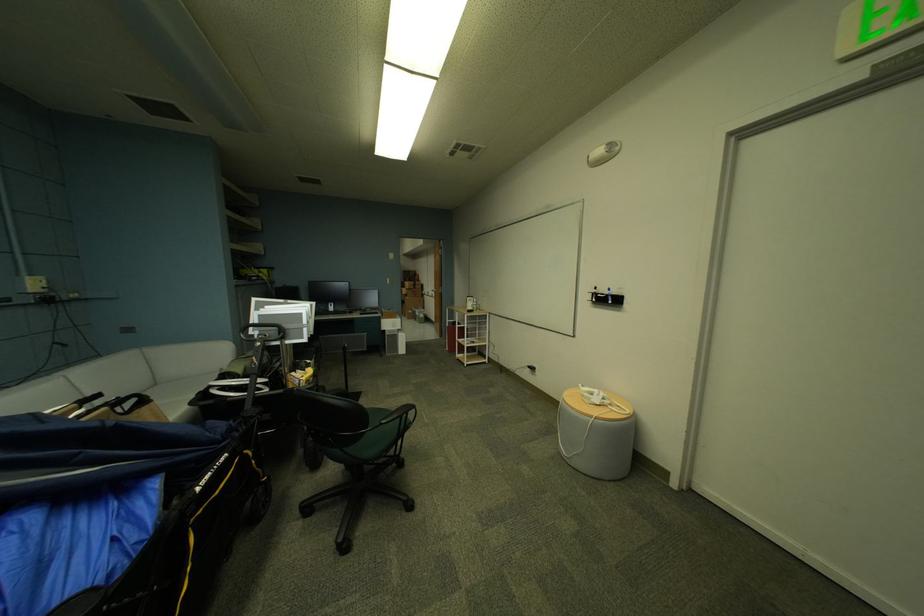
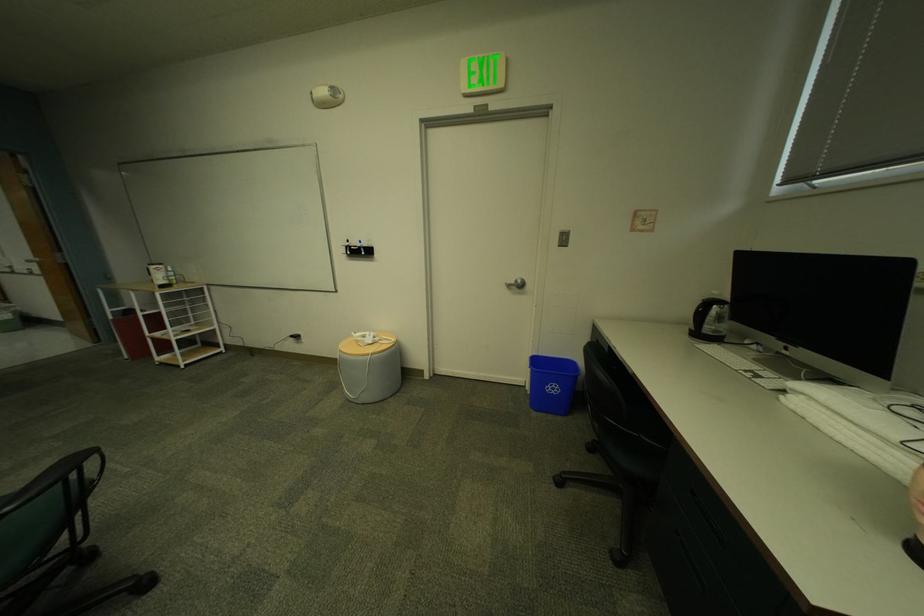
Question: The first image is from the beginning of the video and the second image is from the end. How did the camera likely rotate when shooting the video?

Choices:
 (A) Left
 (B) Right
 (C) Up
 (D) Down

Answer: (B)